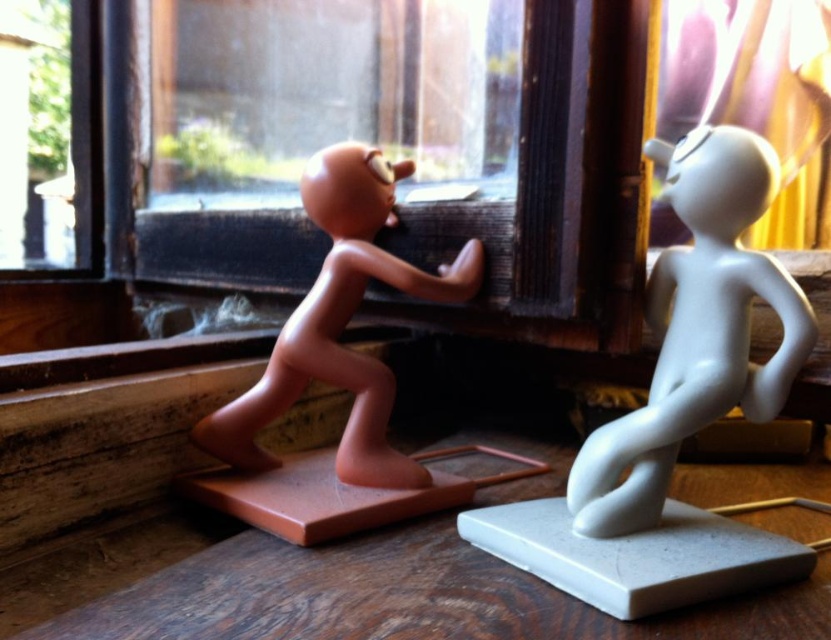
You are a small toy car that wants to move from the matte brown figure at left to the white matte figure at right. Since you can only move forward, will you have to go around any obstacles between them?

The white matte figure at right is closer to the viewer than the matte brown figure at left, so the path between them is not blocked. You can move straight forward from the matte brown figure at left to the white matte figure at right without needing to go around any obstacles.

You are standing in front of the wooden surface with the two figurines. You want to place a small plant exactly at the point marked by the coordinates point (675, 250). Considering the distance from your current position to that point, will you need to step forward or backward to reach it?

The point (675, 250) is 36.19 inches away from the viewer. Since you need to place the plant at that exact point, you should step forward to reach it because it is within a manageable distance for placement.